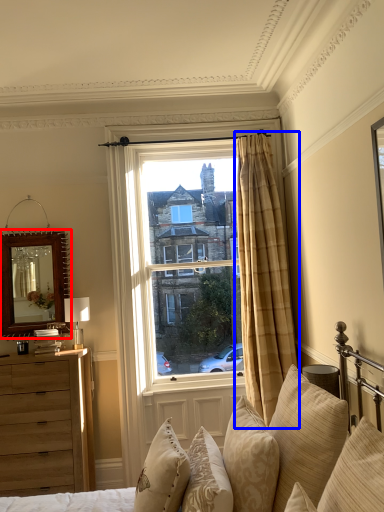
Question: Which object appears farthest to the camera in this image, mirror (highlighted by a red box) or curtain (highlighted by a blue box)?

Choices:
 (A) mirror
 (B) curtain

Answer: (A)